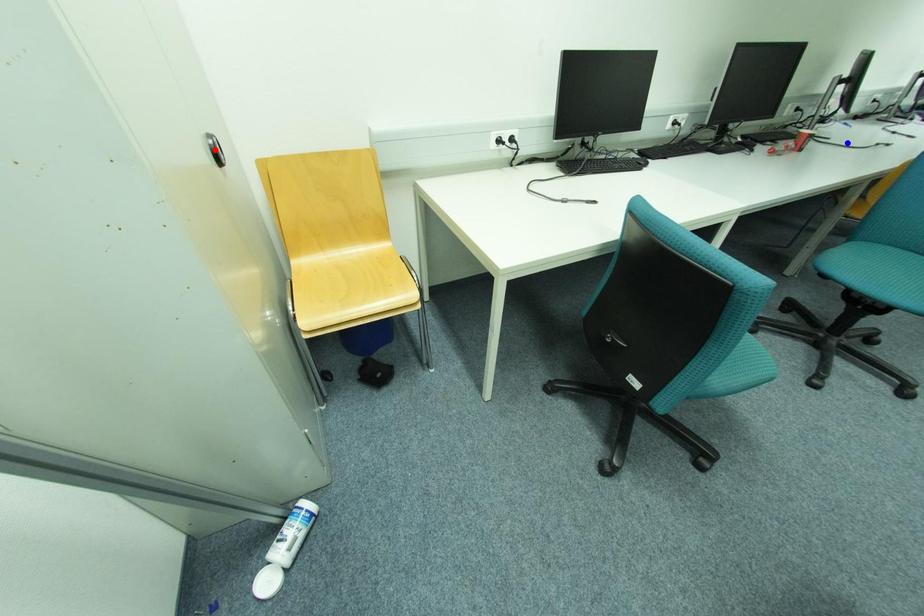
Question: In the image, two points are highlighted. Which point is nearer to the camera? Reply with the corresponding letter.

Choices:
 (A) blue point
 (B) red point

Answer: (B)